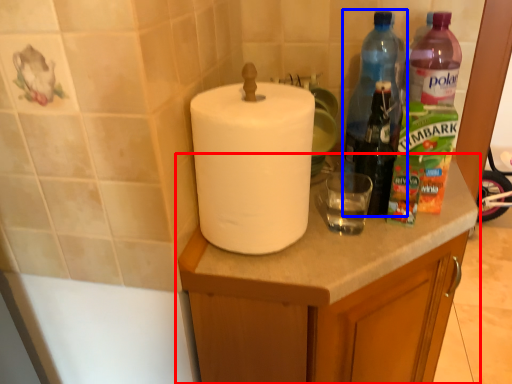
Question: Which point is closer to the camera, cabinetry (highlighted by a red box) or bottle (highlighted by a blue box)?

Choices:
 (A) cabinetry
 (B) bottle

Answer: (A)